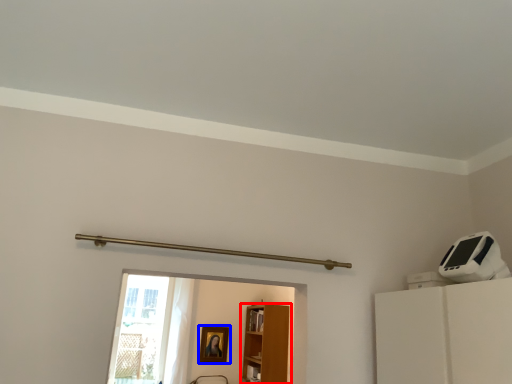
Question: Which point is further to the camera, furniture (highlighted by a red box) or picture frame (highlighted by a blue box)?

Choices:
 (A) furniture
 (B) picture frame

Answer: (B)